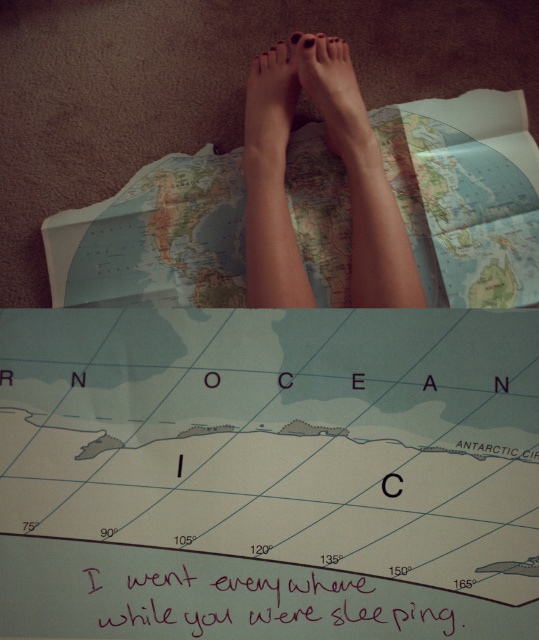
Which is more to the right, handwritten ink writing at center or matte skin foot at center?

Positioned to the right is handwritten ink writing at center.

Who is taller, handwritten ink writing at center or matte skin foot at center?

matte skin foot at center is taller.

I want to click on handwritten ink writing at center, so click(x=253, y=600).

Who is higher up, matte paper map at center or smooth skin feet at center?

smooth skin feet at center is above.

Who is more forward, (203, 227) or (370, 305)?

Point (370, 305) is more forward.

This screenshot has height=640, width=539. In order to click on matte paper map at center in this screenshot , I will do `click(464, 198)`.

Is matte skin foot at center thinner than matte black foot at center?

Yes.

Between matte skin foot at center and matte black foot at center, which one is positioned lower?

matte skin foot at center

Find the location of a particular element. matte skin foot at center is located at coordinates (268, 118).